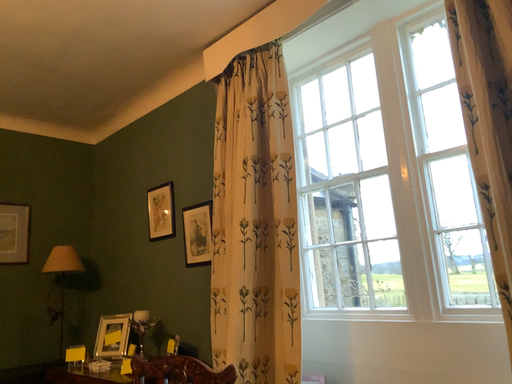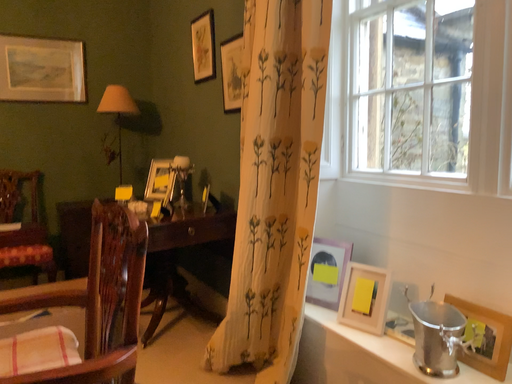
Question: How did the camera likely rotate when shooting the video?

Choices:
 (A) rotated downward
 (B) rotated upward

Answer: (A)